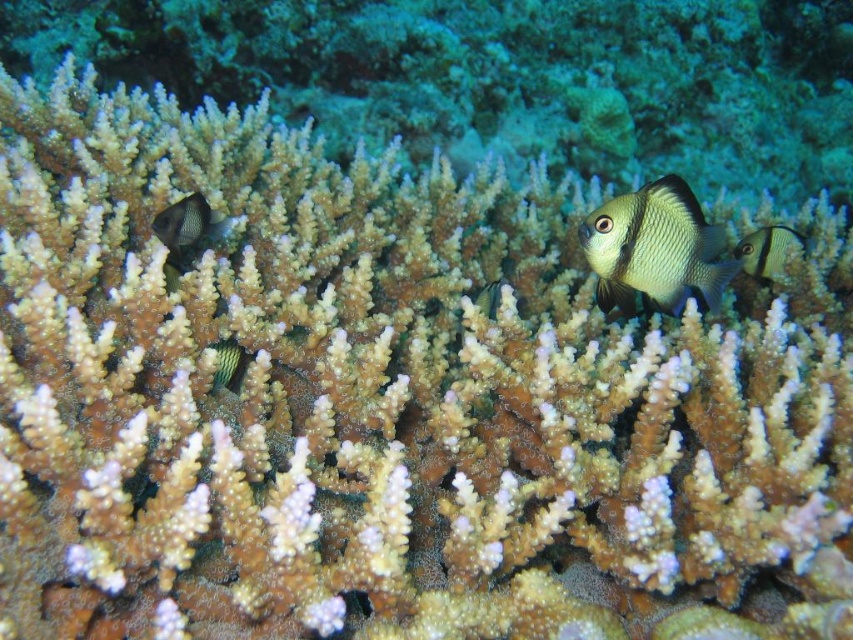
Question: Is shiny green fish at center smaller than green striped fish at center?

Choices:
 (A) yes
 (B) no

Answer: (B)

Question: Based on their relative distances, which object is nearer to the shiny green fish at center?

Choices:
 (A) black matte fish at left
 (B) green striped fish at center
 (C) shiny silver fish at center

Answer: (C)

Question: Which is nearer to the green striped fish at center?

Choices:
 (A) shiny silver fish at center
 (B) black matte fish at left
 (C) shiny green fish at center

Answer: (B)

Question: Is shiny green fish at center wider than shiny silver fish at center?

Choices:
 (A) yes
 (B) no

Answer: (A)

Question: Which object appears closest to the camera in this image?

Choices:
 (A) green striped fish at center
 (B) black matte fish at left

Answer: (A)

Question: Can you confirm if black matte fish at left is wider than green striped fish at center?

Choices:
 (A) no
 (B) yes

Answer: (B)